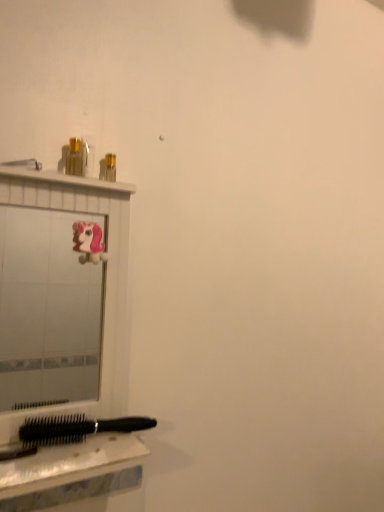
Question: Does point click(79, 141) appear closer or farther from the camera than point click(79, 495)?

Choices:
 (A) farther
 (B) closer

Answer: (A)

Question: Considering the positions of metallic gold toiletry at upper left and black plastic hairbrush at lower left in the image, is metallic gold toiletry at upper left taller or shorter than black plastic hairbrush at lower left?

Choices:
 (A) short
 (B) tall

Answer: (B)

Question: Which of these objects is positioned farthest from the matte white shower at upper left?

Choices:
 (A) metallic gold toiletry at upper left
 (B) black plastic hairbrush at lower left
 (C) white glossy mirror at upper left

Answer: (C)

Question: Estimate the real-world distances between objects in this image. Which object is closer to the black plastic hairbrush at lower left?

Choices:
 (A) metallic gold toiletry at upper left
 (B) white glossy mirror at upper left
 (C) matte white shower at upper left

Answer: (A)